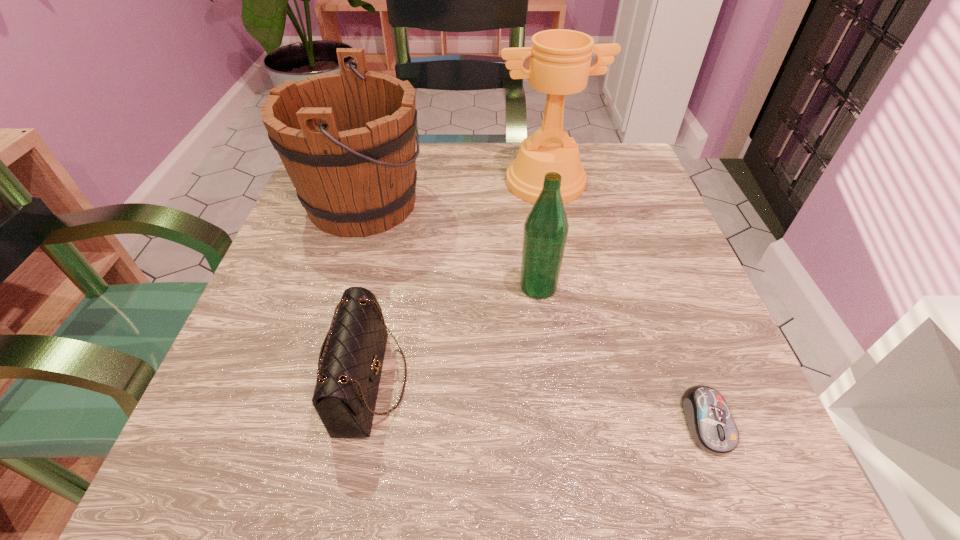
This screenshot has height=540, width=960. What are the coordinates of `free space located 0.230m on the front flap of the clutch bag` in the screenshot? It's located at click(565, 382).

Identify the location of award that is at the far edge. (560, 59).

Locate an element on the screen. The height and width of the screenshot is (540, 960). wine bucket that is at the far edge is located at coordinates (347, 139).

Locate an element on the screen. This screenshot has height=540, width=960. clutch bag at the near edge is located at coordinates (350, 363).

This screenshot has height=540, width=960. Find the location of `computer mouse located at the near edge`. computer mouse located at the near edge is located at coordinates (710, 423).

The width and height of the screenshot is (960, 540). I want to click on object present at the left edge, so click(x=347, y=139).

Where is `award located in the right edge section of the desktop`? The image size is (960, 540). award located in the right edge section of the desktop is located at coordinates (560, 59).

Locate an element on the screen. The width and height of the screenshot is (960, 540). computer mouse at the right edge is located at coordinates (710, 423).

This screenshot has width=960, height=540. Find the location of `object that is at the far left corner`. object that is at the far left corner is located at coordinates (347, 139).

The image size is (960, 540). I want to click on object that is at the far right corner, so click(560, 59).